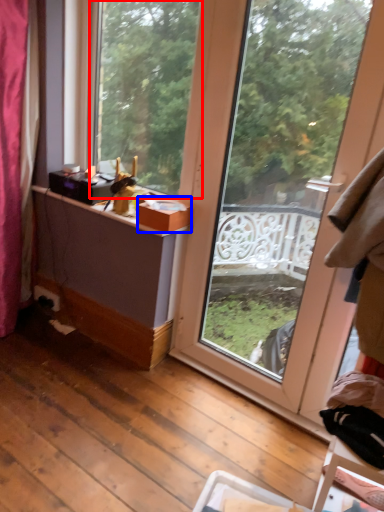
Question: Among these objects, which one is farthest to the camera, window (highlighted by a red box) or box (highlighted by a blue box)?

Choices:
 (A) window
 (B) box

Answer: (B)